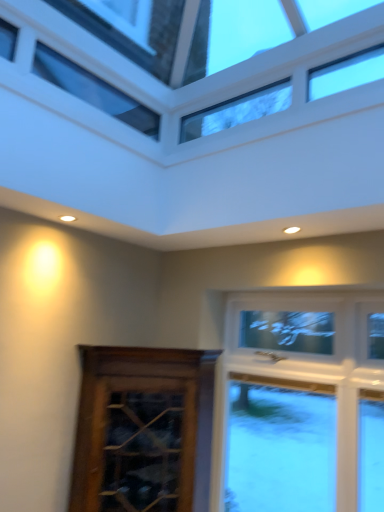
Question: From the image's perspective, is brown wooden cabinet at lower left located above or below transparent glass window at upper center?

Choices:
 (A) above
 (B) below

Answer: (B)

Question: Is brown wooden cabinet at lower left inside the boundaries of transparent glass window at upper center, or outside?

Choices:
 (A) inside
 (B) outside

Answer: (B)

Question: From a real-world perspective, is brown wooden cabinet at lower left positioned above or below transparent glass window at upper center?

Choices:
 (A) above
 (B) below

Answer: (B)

Question: In the image, is transparent glass window at upper center positioned in front of or behind brown wooden cabinet at lower left?

Choices:
 (A) behind
 (B) front

Answer: (B)

Question: Is transparent glass window at upper center inside or outside of brown wooden cabinet at lower left?

Choices:
 (A) outside
 (B) inside

Answer: (A)

Question: Looking at the image, does transparent glass window at upper center seem bigger or smaller compared to brown wooden cabinet at lower left?

Choices:
 (A) small
 (B) big

Answer: (A)

Question: Is transparent glass window at upper center taller or shorter than brown wooden cabinet at lower left?

Choices:
 (A) tall
 (B) short

Answer: (B)